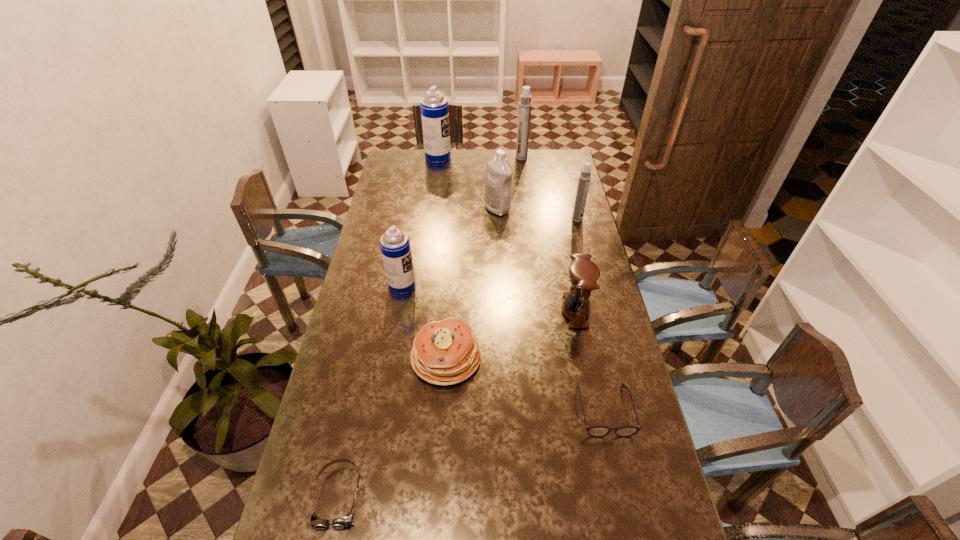
Where is `vacant region located on the front of the hourglass`? Image resolution: width=960 pixels, height=540 pixels. vacant region located on the front of the hourglass is located at coordinates (583, 346).

Where is `free space located 0.100m on the back of the seventh tallest object`? free space located 0.100m on the back of the seventh tallest object is located at coordinates (449, 307).

This screenshot has width=960, height=540. In order to click on vacant space situated 0.150m on the front-facing side of the spectacles in this screenshot , I will do `click(623, 495)`.

I want to click on aerosol can located in the left edge section of the desktop, so click(395, 247).

What are the coordinates of `goggles that is positioned at the left edge` in the screenshot? It's located at (342, 522).

Identify the location of aerosol can that is at the right edge. (584, 178).

Where is `hourglass located in the right edge section of the desktop`? This screenshot has width=960, height=540. hourglass located in the right edge section of the desktop is located at coordinates [583, 274].

You are a GUI agent. You are given a task and a screenshot of the screen. Output one action in this format:
    pyautogui.click(x=<x>, y=<y>)
    Task: Click on the spectacles at the right edge
    
    Given the screenshot: What is the action you would take?
    pyautogui.click(x=595, y=431)

Locate an element on the screen. free region at the far edge of the desktop is located at coordinates (461, 165).

Find the location of a particular element. This screenshot has height=540, width=960. blank space at the left edge of the desktop is located at coordinates (400, 185).